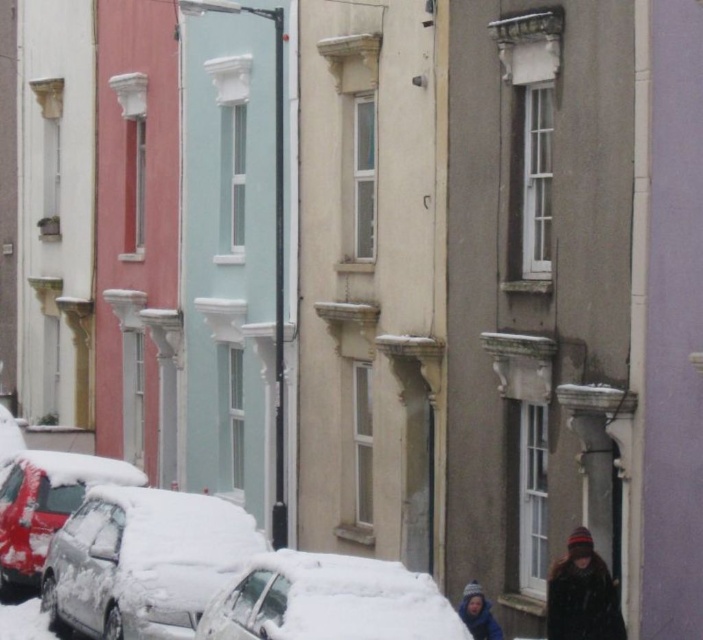
Find the location of a particular element. The image size is (703, 640). shiny red car at lower left is located at coordinates (46, 506).

From the picture: Is shiny red car at lower left taller than blue knit hat at lower right?

Indeed, shiny red car at lower left has a greater height compared to blue knit hat at lower right.

Which is in front, point (70, 474) or point (486, 612)?

Point (486, 612)

I want to click on shiny red car at lower left, so click(x=46, y=506).

Is point (129, 637) less distant than point (344, 595)?

No, (129, 637) is behind (344, 595).

Can you confirm if white matte car at lower left is shorter than white snow-covered car at lower center?

No, white matte car at lower left is not shorter than white snow-covered car at lower center.

Between point (64, 612) and point (361, 630), which one is positioned behind?

The point (64, 612) is behind.

Locate an element on the screen. The height and width of the screenshot is (640, 703). white matte car at lower left is located at coordinates (143, 561).

Is white matte car at lower left taller than blue knit hat at lower right?

Indeed, white matte car at lower left has a greater height compared to blue knit hat at lower right.

Is white matte car at lower left in front of blue knit hat at lower right?

Yes, white matte car at lower left is closer to the viewer.

In order to click on white matte car at lower left in this screenshot , I will do `click(143, 561)`.